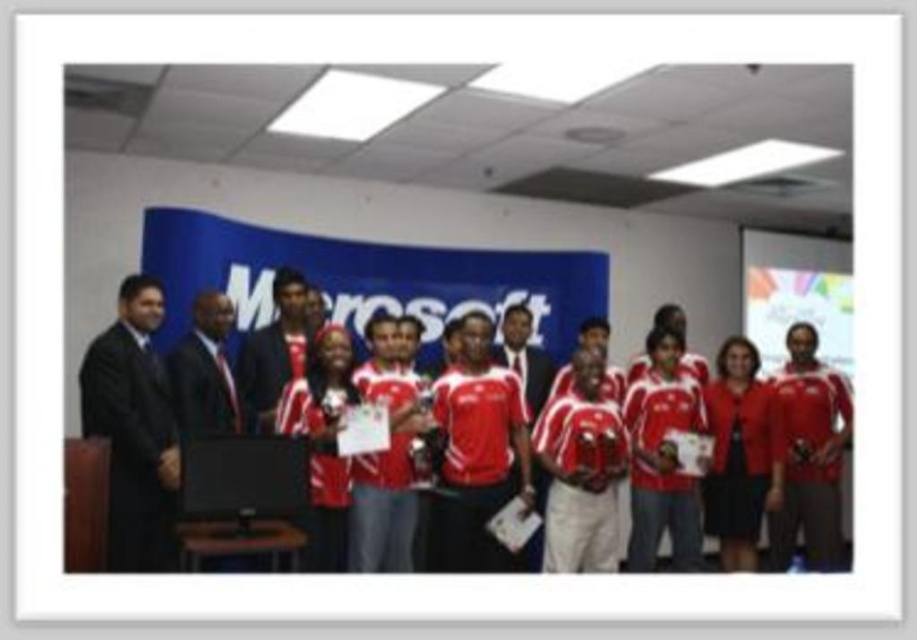
Is matte red jersey at center above black suit at left?

Yes, matte red jersey at center is above black suit at left.

Does point (771, 540) come behind point (164, 420)?

Yes, point (771, 540) is behind point (164, 420).

Is point (205, 360) behind point (142, 419)?

Yes, it is behind point (142, 419).

Locate an element on the screen. matte red jersey at center is located at coordinates click(x=190, y=365).

Who is taller, matte red jersey at center or matte red shirt at center?

Standing taller between the two is matte red shirt at center.

Who is positioned more to the right, matte red jersey at center or matte red shirt at center?

From the viewer's perspective, matte red shirt at center appears more on the right side.

Is point (282, 368) behind point (792, 348)?

No, (282, 368) is closer to viewer.

At what (x,y) coordinates should I click in order to perform the action: click on matte red jersey at center. Please return your answer as a coordinate pair (x, y). Looking at the image, I should click on (190, 365).

Can you confirm if black suit at left is thinner than matte red shirt at center?

Yes, black suit at left is thinner than matte red shirt at center.

Is point (172, 506) positioned before point (794, 420)?

Yes, it is.

This screenshot has width=917, height=640. What are the coordinates of `black suit at left` in the screenshot? It's located at (134, 429).